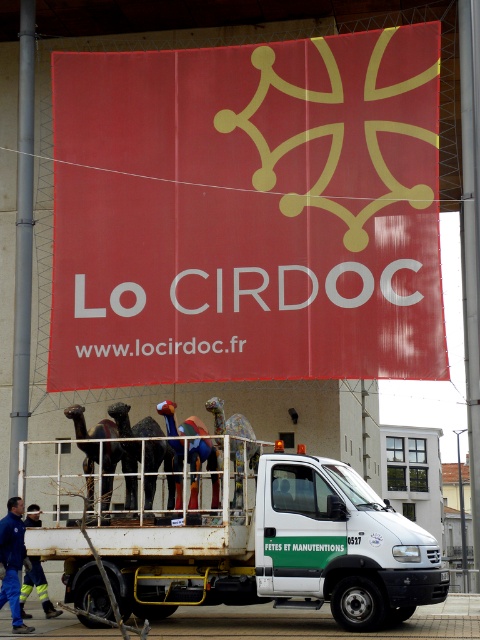
Which of these two, white matte truck at center or yellow reflective safety vest at lower left, stands shorter?

With less height is yellow reflective safety vest at lower left.

Is white matte truck at center smaller than yellow reflective safety vest at lower left?

No.

From the picture: Who is more distant from viewer, (415, 538) or (25, 572)?

The point (25, 572) is behind.

I want to click on white matte truck at center, so (279, 548).

Does red matte sign at upper center have a smaller size compared to yellow reflective safety vest at lower left?

No.

Between point (403, 176) and point (31, 522), which one is positioned in front?

Point (31, 522) is in front.

Identify the location of red matte sign at upper center. This screenshot has height=640, width=480. (248, 212).

Between red matte sign at upper center and blue fabric man at lower left, which one has more height?

Standing taller between the two is red matte sign at upper center.

Is point (215, 84) closer to viewer compared to point (17, 600)?

No, it is not.

Identify the location of red matte sign at upper center. Image resolution: width=480 pixels, height=640 pixels. (248, 212).